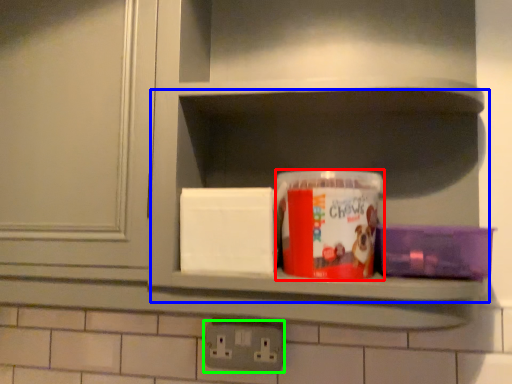
Question: Based on their relative distances, which object is nearer to box (highlighted by a red box)? Choose from cabinet (highlighted by a blue box) and electric outlet (highlighted by a green box).

Choices:
 (A) cabinet
 (B) electric outlet

Answer: (A)